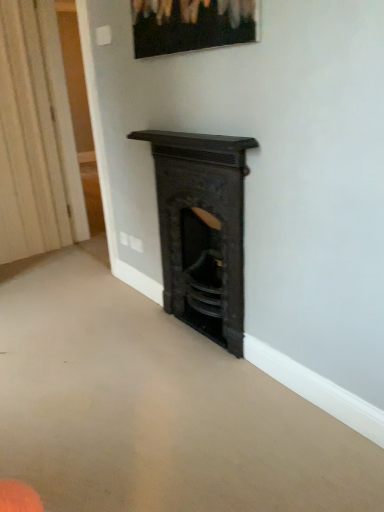
Question: Is white textured curtain at left in front of or behind black cast iron fireplace at center in the image?

Choices:
 (A) behind
 (B) front

Answer: (A)

Question: Considering the positions of point (33, 2) and point (236, 166), is point (33, 2) closer or farther from the camera than point (236, 166)?

Choices:
 (A) farther
 (B) closer

Answer: (A)

Question: Considering the real-world distances, which object is closest to the white textured curtain at left?

Choices:
 (A) black cast iron fireplace at center
 (B) matte black picture frame at upper center

Answer: (A)

Question: Which is nearer to the black cast iron fireplace at center?

Choices:
 (A) matte black picture frame at upper center
 (B) white textured curtain at left

Answer: (A)